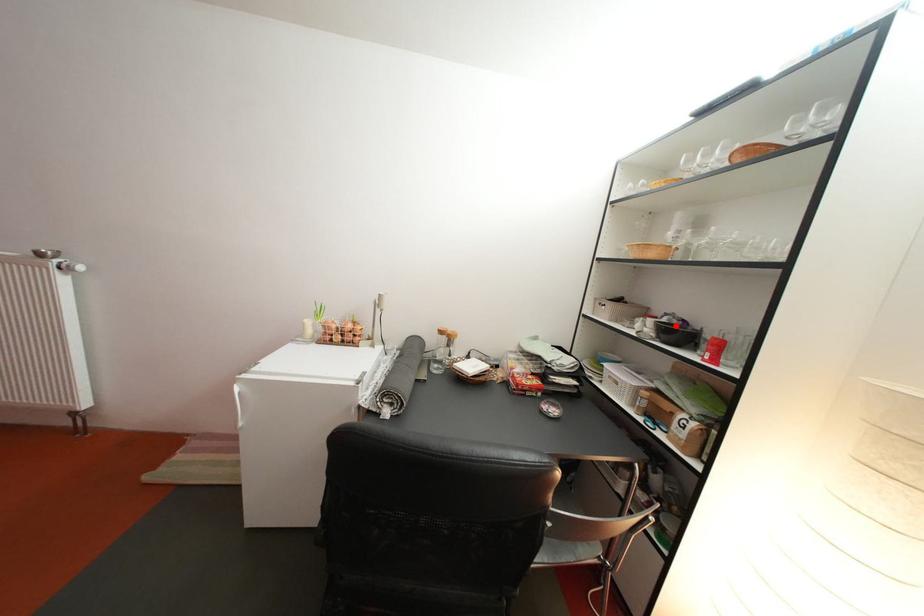
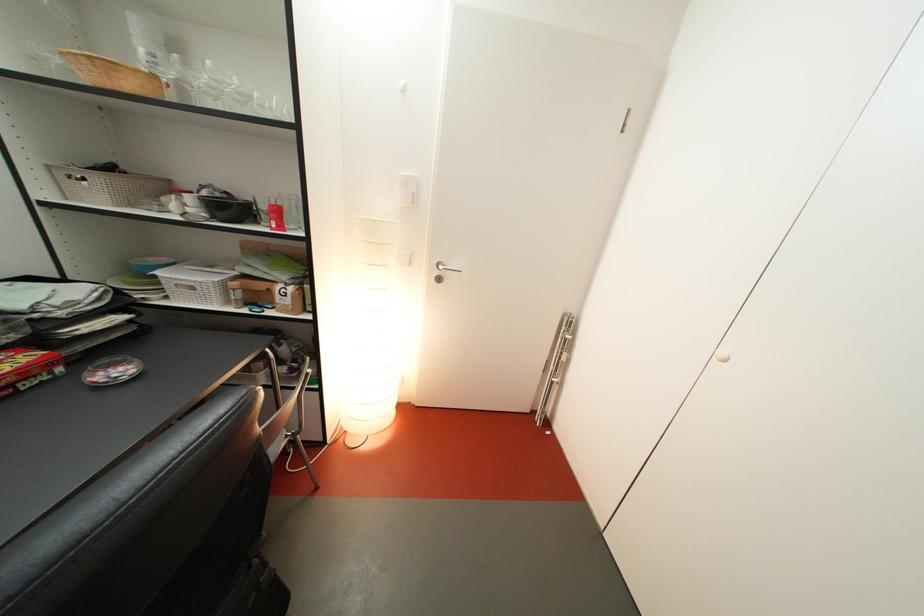
In the second image, find the point that corresponds to the highlighted location in the first image.

(216, 200)